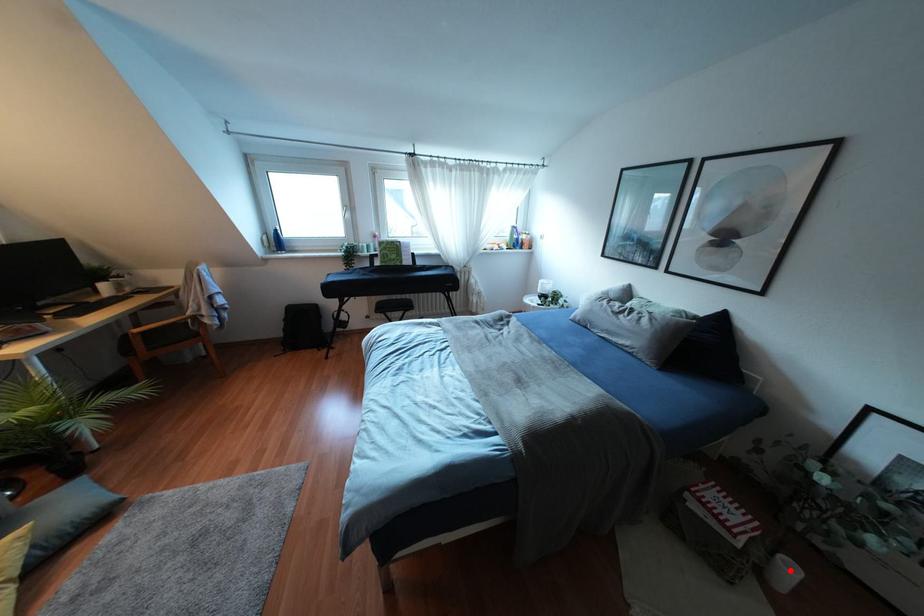
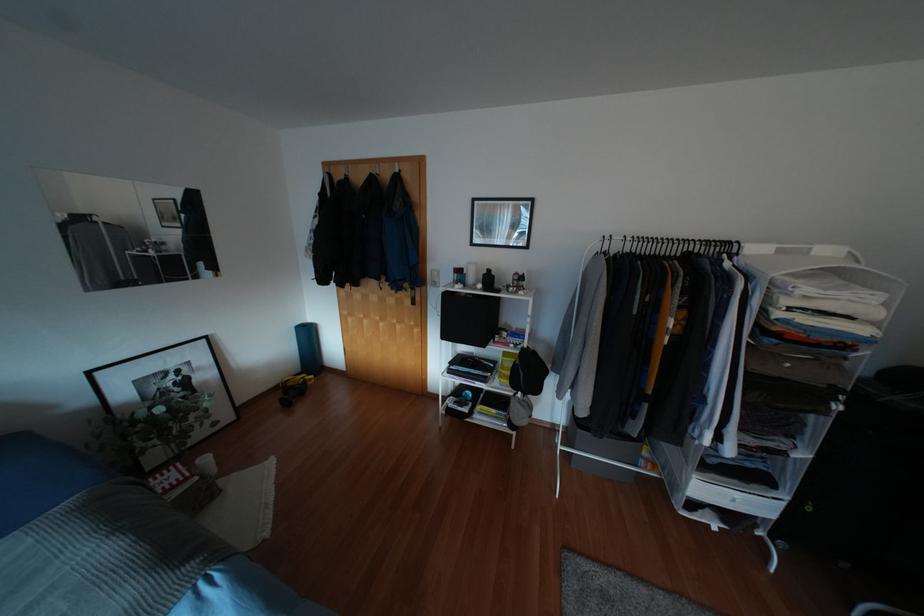
Question: I am providing you with two images of the same scene from different viewpoints. Image1 has a red point marked. In image2, the corresponding 3D location appears at what relative position? Reply with the corresponding letter.

Choices:
 (A) Closer
 (B) Farther

Answer: (B)